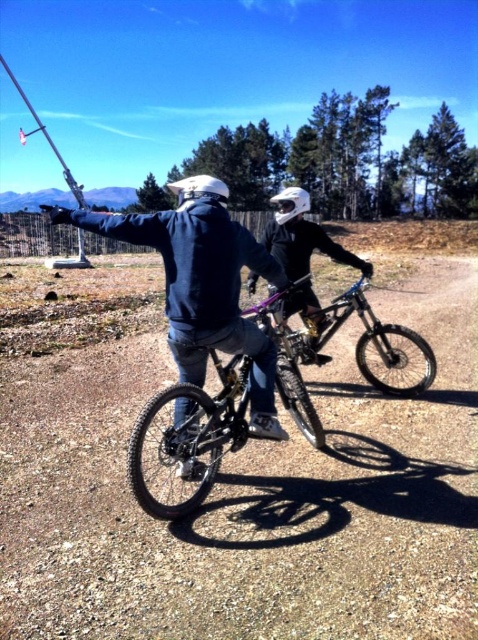
Question: Observing the image, what is the correct spatial positioning of shiny black bicycle at center in reference to shiny metallic bicycle at center?

Choices:
 (A) right
 (B) left

Answer: (B)

Question: Which of the following is the farthest from the observer?

Choices:
 (A) (282, 340)
 (B) (117, 490)

Answer: (A)

Question: Considering the real-world distances, which object is farthest from the dirt track at center?

Choices:
 (A) shiny black bicycle at center
 (B) shiny black helmet at center

Answer: (B)

Question: Can you confirm if dirt track at center is wider than shiny black bicycle at center?

Choices:
 (A) yes
 (B) no

Answer: (A)

Question: Which of these objects is positioned closest to the dirt track at center?

Choices:
 (A) shiny black helmet at center
 (B) shiny metallic bicycle at center
 (C) shiny black bicycle at center

Answer: (B)

Question: Is shiny metallic bicycle at center further to camera compared to shiny black helmet at center?

Choices:
 (A) yes
 (B) no

Answer: (A)